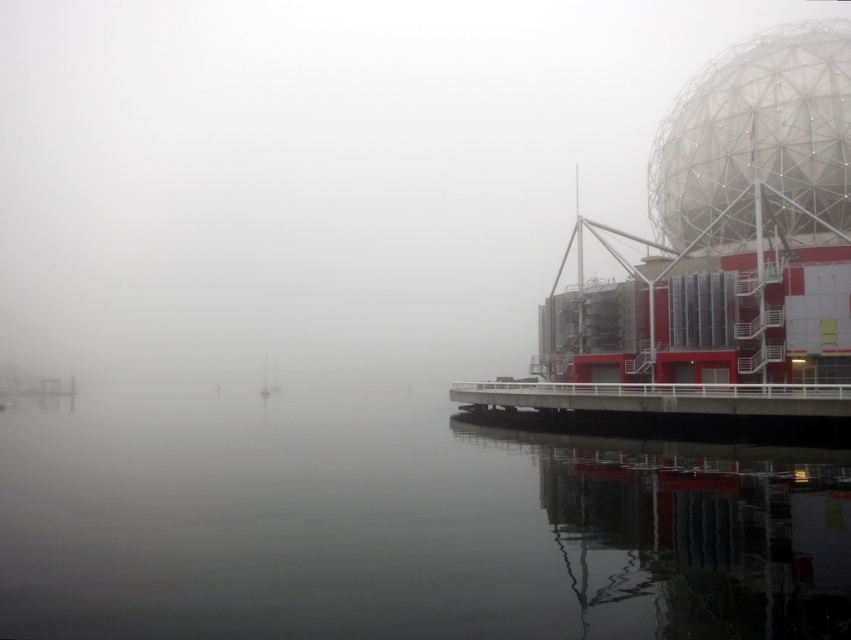
Question: Which point is farther to the camera?

Choices:
 (A) smooth water at center
 (B) white metal dock at lower right
 (C) white metallic dome at upper right

Answer: (C)

Question: Is smooth water at center positioned behind white metal dock at lower right?

Choices:
 (A) yes
 (B) no

Answer: (B)

Question: Which is farther from the white metallic dome at upper right?

Choices:
 (A) white metal dock at lower right
 (B) smooth water at center

Answer: (B)

Question: Which object appears farthest from the camera in this image?

Choices:
 (A) white metallic dome at upper right
 (B) smooth water at center

Answer: (A)

Question: In this image, where is white metallic dome at upper right located relative to white metal dock at lower right?

Choices:
 (A) below
 (B) above

Answer: (B)

Question: Observing the image, what is the correct spatial positioning of smooth water at center in reference to white metal dock at lower right?

Choices:
 (A) above
 (B) below

Answer: (B)